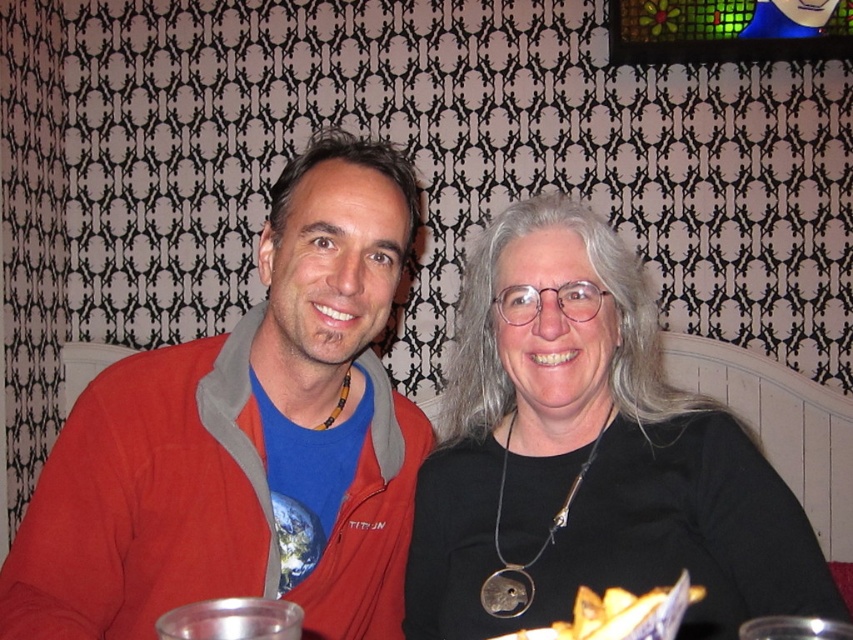
Question: Does matte red jacket at left appear under black matte necklace at center?

Choices:
 (A) yes
 (B) no

Answer: (B)

Question: Can you confirm if black matte necklace at center is bigger than yellow crispy chips at lower center?

Choices:
 (A) no
 (B) yes

Answer: (B)

Question: Which point is closer to the camera?

Choices:
 (A) black matte necklace at center
 (B) matte red jacket at left

Answer: (B)

Question: Does black matte necklace at center lie behind yellow crispy chips at lower center?

Choices:
 (A) yes
 (B) no

Answer: (A)

Question: Considering the real-world distances, which object is closest to the yellow crispy chips at lower center?

Choices:
 (A) matte red jacket at left
 (B) black matte necklace at center

Answer: (B)

Question: Estimate the real-world distances between objects in this image. Which object is closer to the black matte necklace at center?

Choices:
 (A) yellow crispy chips at lower center
 (B) matte red jacket at left

Answer: (B)